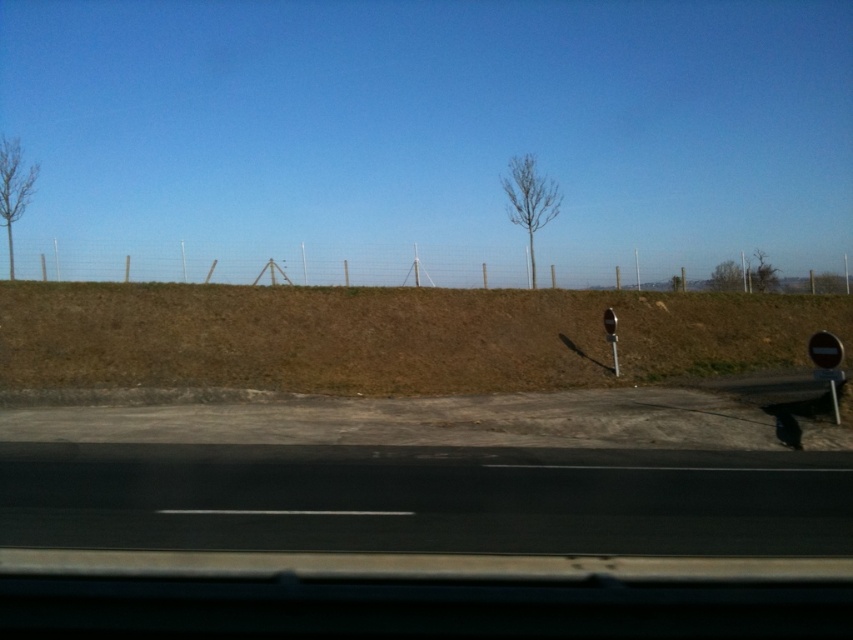
Based on the photo, you are driving a car and want to know if you can safely stop before hitting an obstacle on the road. Your car is currently 50 meters away from the black asphalt highway at lower center and moving towards it. The bare wood tree at center is 30.85 meters away from the highway. If you apply the brakes now, will your car stop before reaching the highway?

The distance between the black asphalt highway at lower center and the bare wood tree at center is 30.85 meters. Since your car is 50 meters away from the highway, you are still 19.15 meters behind the tree. Therefore, applying brakes now would allow you to stop before reaching the highway.

You are driving a car and want to know if you can safely stop before reaching the point at coordinates [585,454]. Your car can brake at 8 m per second squared. If you are currently traveling at 20 meters per second, will you stop in time?

To determine if the car can stop safely, calculate the braking distance using the formula distance equals velocity squared divided by twice the deceleration. Plugging in the numbers, the braking distance is 20 squared divided by 2 times 8, which equals 25 meters. Since the distance to the point is 11.59 meters, which is less than 25 meters, the car will stop before reaching the point at coordinates [585,454].

You are a driver looking out the car window and see the bare wood tree at center and the bare branches at upper right. Which one appears taller in the scene?

The bare wood tree at center appears taller than the bare branches at upper right.